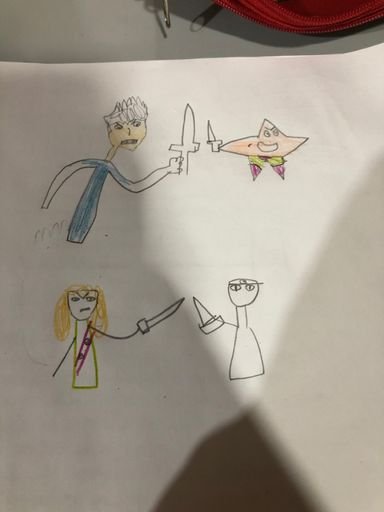
Where is `sash`? The height and width of the screenshot is (512, 384). sash is located at coordinates (86, 350).